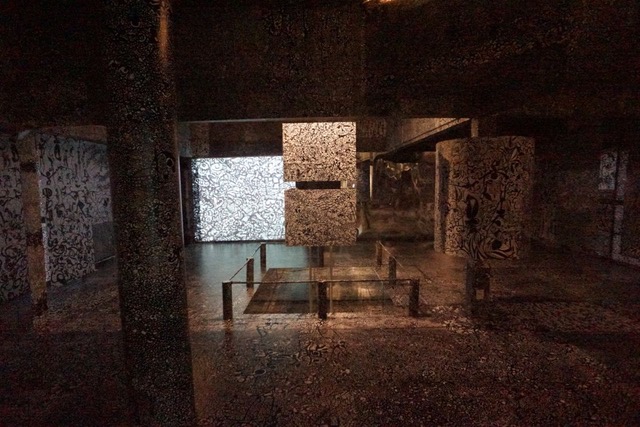
In order to click on floor tiles in this screenshot , I will do `click(368, 380)`.